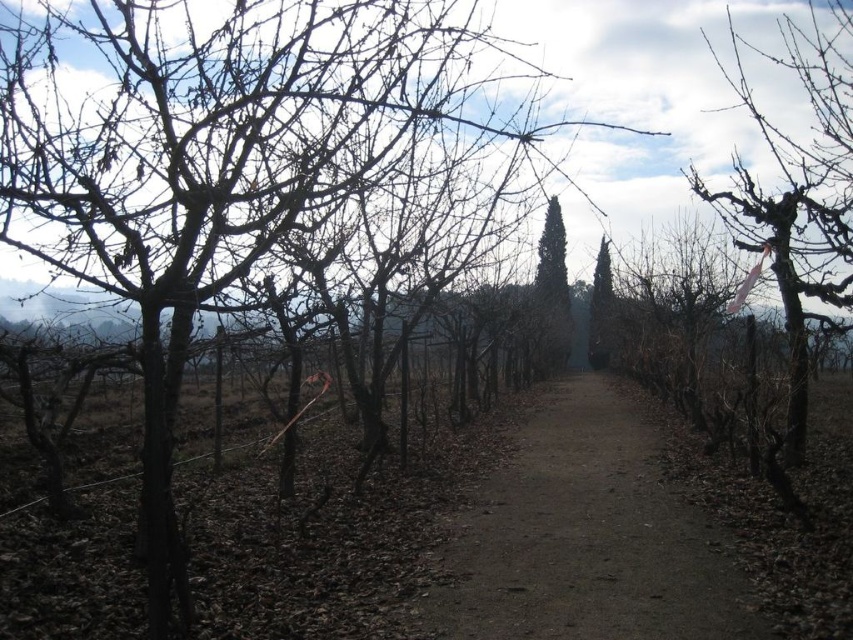
Question: Is brown dirt path at center to the left of green textured tree at center from the viewer's perspective?

Choices:
 (A) yes
 (B) no

Answer: (A)

Question: Which of the following is the farthest from the observer?

Choices:
 (A) green textured tree at center
 (B) brown dirt path at center
 (C) green textured cypress at center
 (D) pink ribbon at right

Answer: (A)

Question: Which point is closer to the camera?

Choices:
 (A) pink ribbon at right
 (B) brown dirt path at center
 (C) green textured cypress at center
 (D) green textured tree at center

Answer: (B)

Question: Does green textured cypress at center appear on the left side of green textured tree at center?

Choices:
 (A) yes
 (B) no

Answer: (A)

Question: Which object appears closest to the camera in this image?

Choices:
 (A) pink ribbon at right
 (B) green textured cypress at center

Answer: (A)

Question: Is pink ribbon at right below green textured tree at center?

Choices:
 (A) yes
 (B) no

Answer: (B)